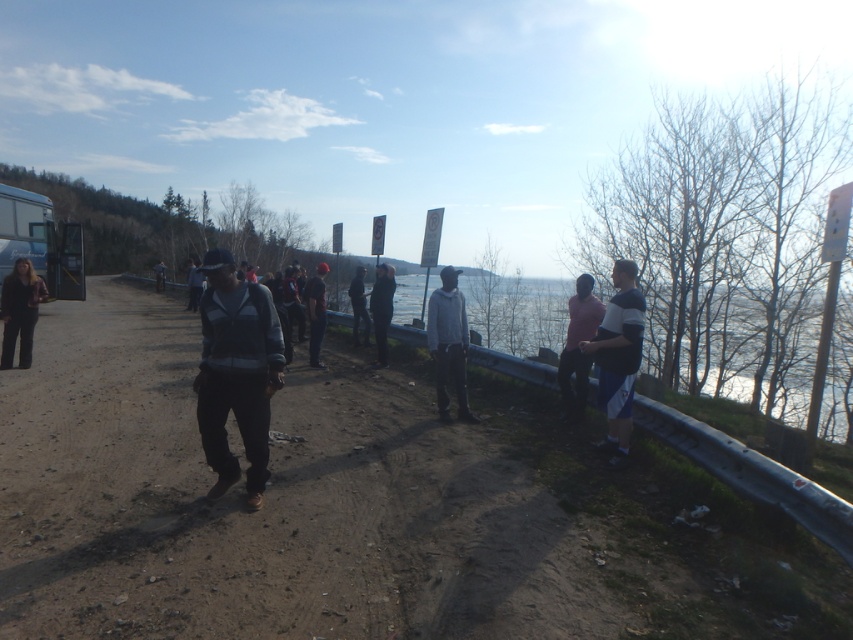
Question: Does dark gray hoodie at center have a greater width compared to dark gray jacket at center?

Choices:
 (A) yes
 (B) no

Answer: (B)

Question: Which is nearer to the dark gray hoodie at center?

Choices:
 (A) matte black jacket at left
 (B) dark blue jeans at center

Answer: (B)

Question: Is dark gray fleece jacket at center positioned in front of striped sweater at right?

Choices:
 (A) no
 (B) yes

Answer: (B)

Question: Is dark gray fleece jacket at center thinner than gray matte jacket at center?

Choices:
 (A) yes
 (B) no

Answer: (B)

Question: Estimate the real-world distances between objects in this image. Which object is farther from the striped sweater at right?

Choices:
 (A) dark gray fleece jacket at center
 (B) matte black jacket at left
 (C) dark blue jacket at center

Answer: (B)

Question: Based on their relative distances, which object is farther from the matte black jacket at left?

Choices:
 (A) dark blue jacket at center
 (B) dark gray hoodie at center
 (C) dark gray fabric jacket at center
 (D) dark blue jeans at center

Answer: (B)